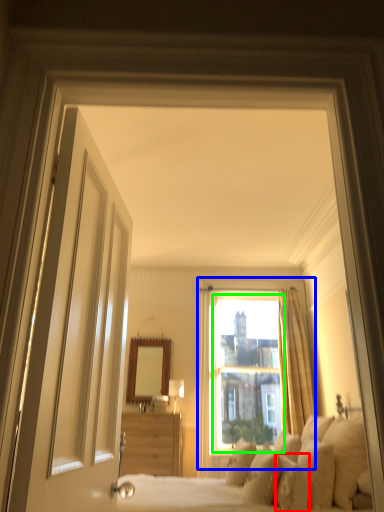
Question: Which is farther away from pillow (highlighted by a red box)? window (highlighted by a blue box) or window screen (highlighted by a green box)?

Choices:
 (A) window
 (B) window screen

Answer: (A)